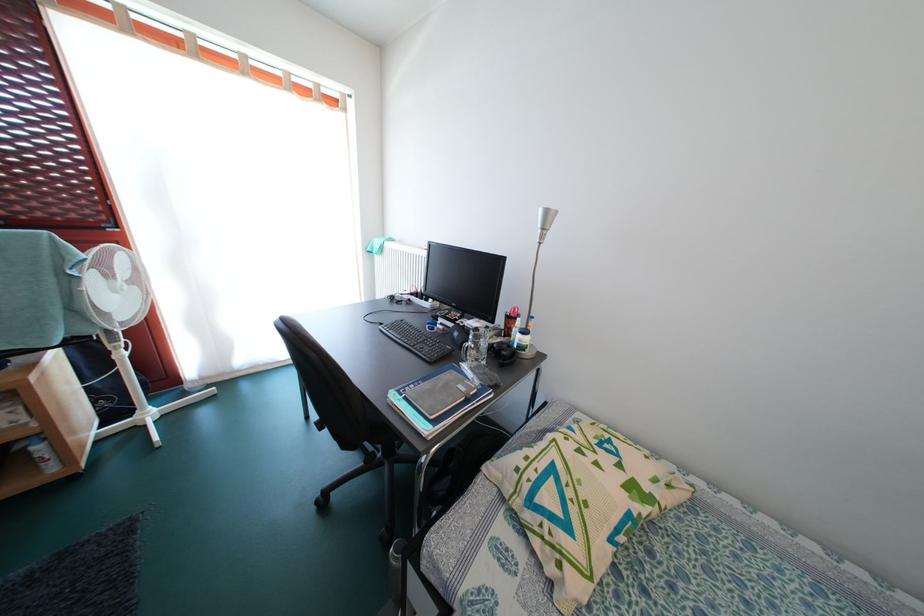
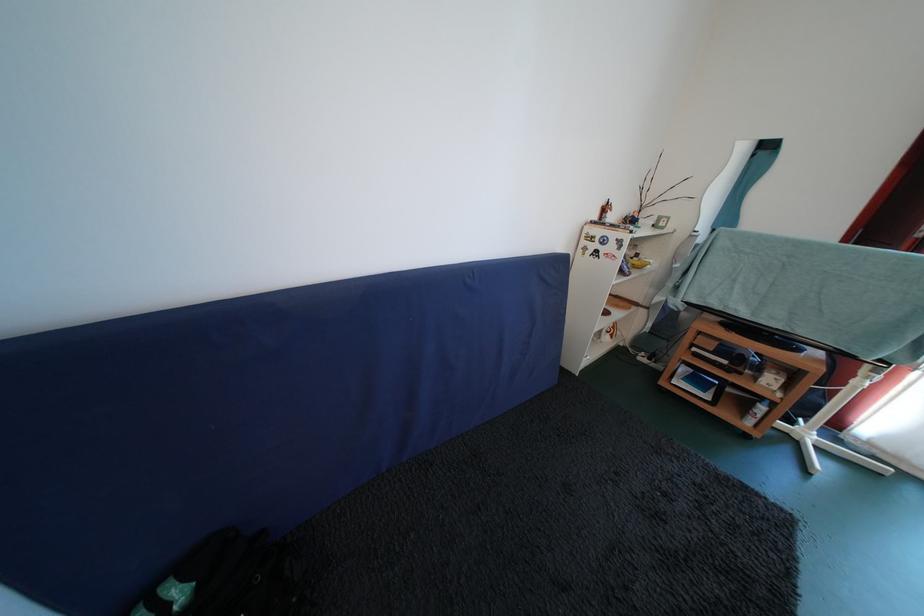
The first image is from the beginning of the video and the second image is from the end. How did the camera likely rotate when shooting the video?

The rotation direction of the camera is left-down.